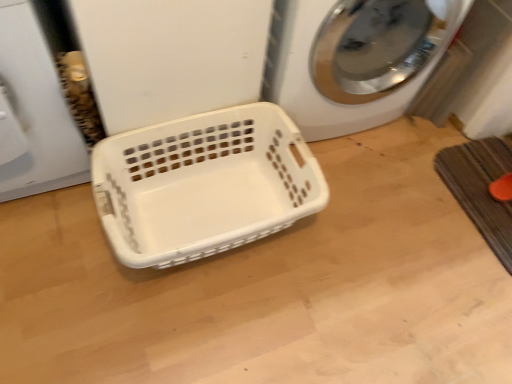
Question: Is white plastic basket at center inside brown textured bath mat at lower right?

Choices:
 (A) no
 (B) yes

Answer: (A)

Question: Is brown textured bath mat at lower right next to white plastic basket at center?

Choices:
 (A) yes
 (B) no

Answer: (B)

Question: Does brown textured bath mat at lower right turn towards white plastic basket at center?

Choices:
 (A) yes
 (B) no

Answer: (B)

Question: Is brown textured bath mat at lower right to the left of white plastic basket at center from the viewer's perspective?

Choices:
 (A) yes
 (B) no

Answer: (B)

Question: Does brown textured bath mat at lower right come in front of white plastic basket at center?

Choices:
 (A) yes
 (B) no

Answer: (B)

Question: In the image, is white plastic washing machine at center on the left side or the right side of white plastic basket at center?

Choices:
 (A) right
 (B) left

Answer: (A)

Question: From their relative heights in the image, would you say white plastic washing machine at center is taller or shorter than white plastic basket at center?

Choices:
 (A) short
 (B) tall

Answer: (B)

Question: Is point (282, 92) positioned closer to the camera than point (104, 165)?

Choices:
 (A) closer
 (B) farther

Answer: (B)

Question: Is white plastic washing machine at center spatially inside white plastic basket at center, or outside of it?

Choices:
 (A) inside
 (B) outside

Answer: (B)

Question: Relative to white plastic washing machine at center, is brown textured bath mat at lower right in front or behind?

Choices:
 (A) behind
 (B) front

Answer: (A)

Question: Considering the relative positions of brown textured bath mat at lower right and white plastic washing machine at center in the image provided, is brown textured bath mat at lower right to the left or to the right of white plastic washing machine at center?

Choices:
 (A) left
 (B) right

Answer: (B)

Question: From a real-world perspective, is brown textured bath mat at lower right positioned above or below white plastic washing machine at center?

Choices:
 (A) below
 (B) above

Answer: (A)

Question: From the image's perspective, is brown textured bath mat at lower right positioned above or below white plastic washing machine at center?

Choices:
 (A) above
 (B) below

Answer: (B)

Question: Is white plastic basket at center spatially inside white plastic washing machine at center, or outside of it?

Choices:
 (A) inside
 (B) outside

Answer: (B)

Question: Considering the positions of point (165, 152) and point (275, 92), is point (165, 152) closer or farther from the camera than point (275, 92)?

Choices:
 (A) farther
 (B) closer

Answer: (A)